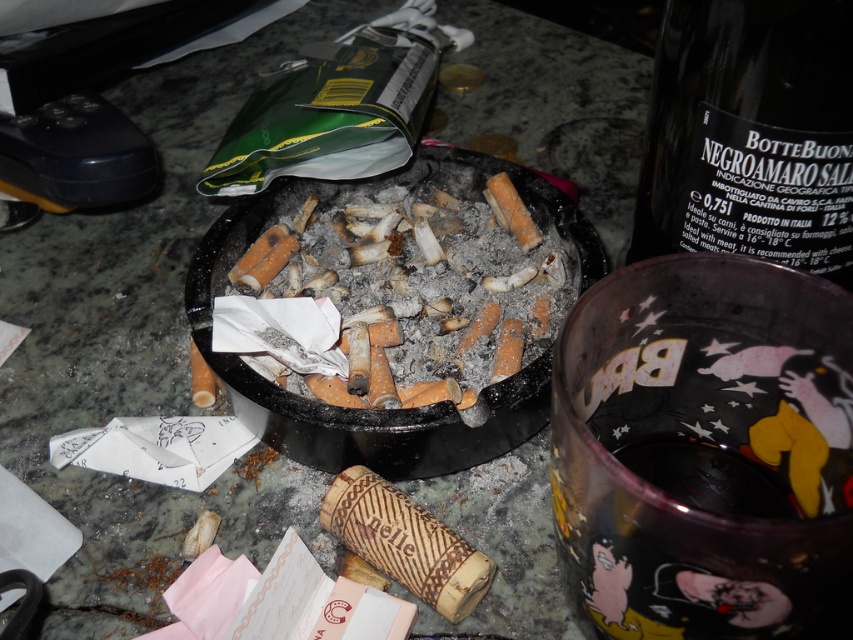
Question: Does dark green glass bottle at upper right have a smaller size compared to charcoal ash at center?

Choices:
 (A) yes
 (B) no

Answer: (A)

Question: Which object appears closest to the camera in this image?

Choices:
 (A) dark green glass bottle at upper right
 (B) charcoal ash at center

Answer: (A)

Question: Is dark green glass bottle at upper right behind charcoal ash at center?

Choices:
 (A) no
 (B) yes

Answer: (A)

Question: Is dark green glass bottle at upper right below charcoal ash at center?

Choices:
 (A) yes
 (B) no

Answer: (B)

Question: Which point appears farthest from the camera in this image?

Choices:
 (A) tap(505, 284)
 (B) tap(741, 180)

Answer: (A)